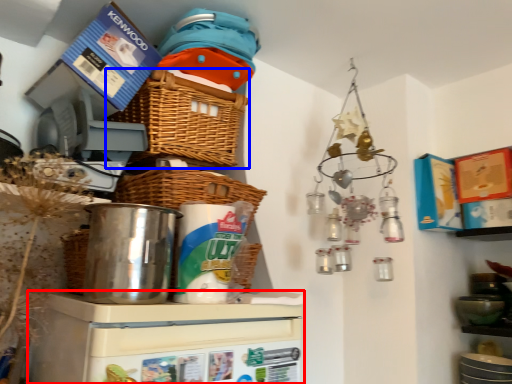
Question: Which point is further to the camera, appliance (highlighted by a red box) or basket (highlighted by a blue box)?

Choices:
 (A) appliance
 (B) basket

Answer: (B)